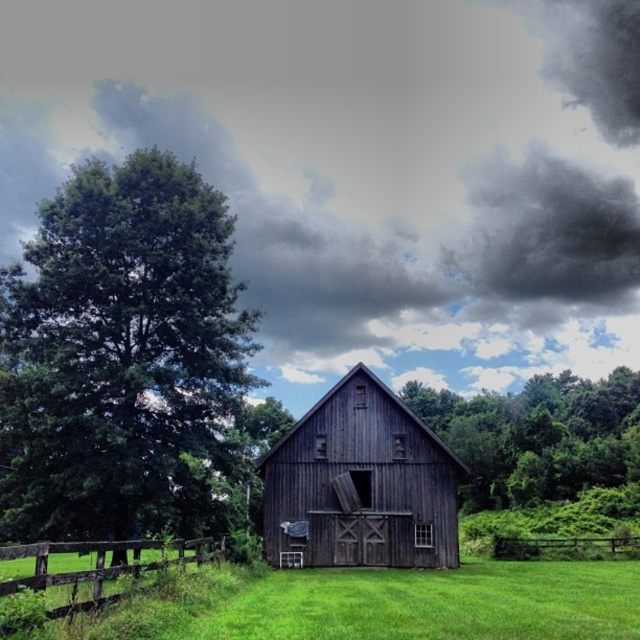
You are standing in front of the barn and notice two points marked on the barn wall. The first point is at coordinate point (420, 515) and the second is at point (476, 458). Which point is closer to your current position?

Point (420, 515) is closer to the camera than point (476, 458), so the first point is closer to your current position.

You are standing at the entrance of the rustic wooden barn and notice two points marked on the ground. The first point is at coordinate point (557, 188) and the second is at point (417, 500). If you were to walk towards the dense trees in the background, which point would you encounter first?

Point (417, 500) would be encountered first because it is in front of point (557, 188) according to their spatial arrangement.

You are standing in the field near the brown wooden fence at lower right and want to reach the green leafy tree at center. Which direction should you walk to get there?

You should walk towards the center because the green leafy tree at center is positioned over the brown wooden fence at lower right, meaning it is located above and closer to the middle of the scene.